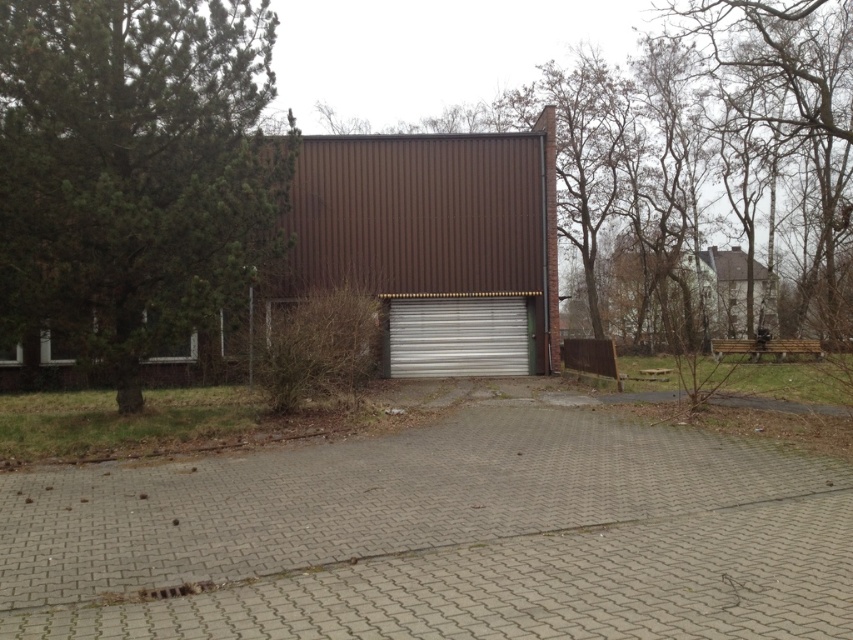
Which is behind, point (251, 33) or point (521, 364)?

The point (521, 364) is more distant.

Is green textured tree at left positioned behind silver metallic garage door at center?

That is False.

You are a GUI agent. You are given a task and a screenshot of the screen. Output one action in this format:
    pyautogui.click(x=<x>, y=<y>)
    Task: Click on the green textured tree at left
    The height and width of the screenshot is (640, 853).
    Given the screenshot: What is the action you would take?
    pyautogui.click(x=134, y=168)

Between gray paving stones at center and brown corrugated metal garage at center, which one has less height?

gray paving stones at center

Can you confirm if gray paving stones at center is positioned below brown corrugated metal garage at center?

Yes.

Is point (604, 476) closer to camera compared to point (412, 268)?

Yes, point (604, 476) is closer to viewer.

Find the location of a particular element. gray paving stones at center is located at coordinates (440, 536).

Can you confirm if gray paving stones at center is bigger than silver metallic garage door at center?

Indeed, gray paving stones at center has a larger size compared to silver metallic garage door at center.

Consider the image. Does gray paving stones at center appear under silver metallic garage door at center?

Yes, gray paving stones at center is below silver metallic garage door at center.

Consider the image. Who is more distant from viewer, [581,541] or [383,349]?

Point [383,349]

This screenshot has height=640, width=853. I want to click on gray paving stones at center, so click(440, 536).